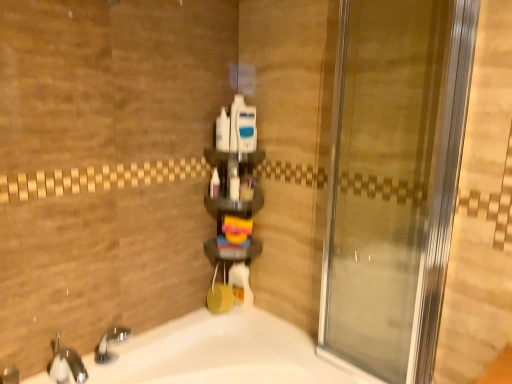
You are a GUI agent. You are given a task and a screenshot of the screen. Output one action in this format:
    pyautogui.click(x=<x>, y=<y>)
    Task: Click on the white plastic container at center, the 2th toiletry positioned from the right
    The image size is (512, 384).
    Given the screenshot: What is the action you would take?
    pyautogui.click(x=237, y=128)

Describe the element at coordinates (390, 186) in the screenshot. The image size is (512, 384). I see `transparent glass door at center` at that location.

Image resolution: width=512 pixels, height=384 pixels. Identify the location of white plastic bottles at center, placed as the 4th toiletry when sorted from right to left. (222, 131).

At what (x,y) coordinates should I click in order to perform the action: click on white glossy bathtub at lower left. Please return your answer as a coordinate pair (x, y). Image resolution: width=512 pixels, height=384 pixels. Looking at the image, I should click on (220, 353).

Is brushed metal faucet at lower left next to transparent glass door at center and touching it?

No, brushed metal faucet at lower left is not making contact with transparent glass door at center.

Based on their positions, is brushed metal faucet at lower left located to the left or right of transparent glass door at center?

Based on their positions, brushed metal faucet at lower left is located to the left of transparent glass door at center.

Is brushed metal faucet at lower left in front of or behind transparent glass door at center in the image?

Clearly, brushed metal faucet at lower left is behind transparent glass door at center.

Is point (16, 380) closer or farther from the camera than point (455, 51)?

Point (16, 380) is farther from the camera than point (455, 51).

Can you confirm if translucent plastic shelf at center is taller than brushed metal faucet at lower left?

Yes.

Locate an element on the screen. shelf that is on the right side of brushed metal faucet at lower left is located at coordinates (234, 160).

Consider the image. Choose the correct answer: Is translucent plastic shelf at center inside brushed metal faucet at lower left or outside it?

translucent plastic shelf at center exists outside the volume of brushed metal faucet at lower left.

Consider the image. Is translucent plastic shelf at center placed right next to brushed metal faucet at lower left?

No, translucent plastic shelf at center is not beside brushed metal faucet at lower left.

Does translucent plastic bottle at center, which is the 1th toiletry from left to right, have a smaller size compared to transparent glass door at center?

Yes.

From the picture: Which object is further away from the camera taking this photo, translucent plastic bottle at center, arranged as the fifth toiletry when viewed from the right, or transparent glass door at center?

translucent plastic bottle at center, arranged as the fifth toiletry when viewed from the right, is more distant.

Is point (214, 177) positioned after point (417, 371)?

That is True.

From a real-world perspective, between translucent plastic bottle at center, arranged as the fifth toiletry when viewed from the right, and transparent glass door at center, who is vertically lower?

In real-world perspective, translucent plastic bottle at center, arranged as the fifth toiletry when viewed from the right, is lower.

Can you see blue plastic razor at center, which is the first toiletry from right to left, touching white glossy bottle at center, which is counted as the 3th toiletry, starting from the right?

blue plastic razor at center, which is the first toiletry from right to left, and white glossy bottle at center, which is counted as the 3th toiletry, starting from the right, are not in contact.

Can you tell me how much blue plastic razor at center, which is the first toiletry from right to left, and white glossy bottle at center, which is counted as the 3th toiletry, starting from the right, differ in facing direction?

0.537 degrees.

In terms of size, does blue plastic razor at center, which is the first toiletry from right to left, appear bigger or smaller than white glossy bottle at center, positioned as the third toiletry in left-to-right order?

blue plastic razor at center, which is the first toiletry from right to left, is bigger than white glossy bottle at center, positioned as the third toiletry in left-to-right order.

From a real-world perspective, is blue plastic razor at center, the fifth toiletry from the left, physically located above or below white glossy bottle at center, which is counted as the 3th toiletry, starting from the right?

In terms of real-world spatial position, blue plastic razor at center, the fifth toiletry from the left, is above white glossy bottle at center, which is counted as the 3th toiletry, starting from the right.

Is translucent plastic shelf at center not close to white plastic container at center, the 4th toiletry when ordered from left to right?

Actually, translucent plastic shelf at center and white plastic container at center, the 4th toiletry when ordered from left to right, are a little close together.

From the image's perspective, which one is positioned higher, translucent plastic shelf at center or white plastic container at center, the 2th toiletry positioned from the right?

white plastic container at center, the 2th toiletry positioned from the right.

Between translucent plastic shelf at center and white plastic container at center, the 2th toiletry positioned from the right, which one has larger size?

With larger size is translucent plastic shelf at center.

Consider the image. From a real-world perspective, which is physically above, translucent plastic shelf at center or white plastic container at center, the 2th toiletry positioned from the right?

white plastic container at center, the 2th toiletry positioned from the right, from a real-world perspective.

Looking at this image, is brushed metal faucet at lower left spatially inside translucent plastic bottle at center, which is the 1th toiletry from left to right, or outside of it?

brushed metal faucet at lower left exists outside the volume of translucent plastic bottle at center, which is the 1th toiletry from left to right.

Considering the relative positions of brushed metal faucet at lower left and translucent plastic bottle at center, arranged as the fifth toiletry when viewed from the right, in the image provided, is brushed metal faucet at lower left in front of translucent plastic bottle at center, arranged as the fifth toiletry when viewed from the right,?

Yes, it is in front of translucent plastic bottle at center, arranged as the fifth toiletry when viewed from the right.

Is the surface of brushed metal faucet at lower left in direct contact with translucent plastic bottle at center, arranged as the fifth toiletry when viewed from the right?

brushed metal faucet at lower left and translucent plastic bottle at center, arranged as the fifth toiletry when viewed from the right, are not in contact.

Which of these two, transparent glass door at center or translucent plastic shelf at center, stands taller?

Standing taller between the two is transparent glass door at center.

Is transparent glass door at center to the left of translucent plastic shelf at center from the viewer's perspective?

In fact, transparent glass door at center is to the right of translucent plastic shelf at center.

Could you tell me if transparent glass door at center is facing translucent plastic shelf at center?

No, transparent glass door at center does not turn towards translucent plastic shelf at center.

In terms of size, does transparent glass door at center appear bigger or smaller than translucent plastic shelf at center?

Considering their sizes, transparent glass door at center takes up more space than translucent plastic shelf at center.

I want to click on faucet below the transparent glass door at center (from the image's perspective), so click(x=10, y=376).

The height and width of the screenshot is (384, 512). Identify the location of shelf above the brushed metal faucet at lower left (from the image's perspective). (234, 160).

Estimate the real-world distances between objects in this image. Which object is further from white plastic bottles at center, placed as the 2th toiletry when sorted from left to right, white glossy bottle at center, which is counted as the 3th toiletry, starting from the right, or translucent plastic shelf at center?

The object further to white plastic bottles at center, placed as the 2th toiletry when sorted from left to right, is white glossy bottle at center, which is counted as the 3th toiletry, starting from the right.

Based on their spatial positions, is translucent plastic bottle at center, which is the 1th toiletry from left to right, or white glossy bottle at center, positioned as the third toiletry in left-to-right order, closer to white glossy bathtub at lower left?

Based on the image, white glossy bottle at center, positioned as the third toiletry in left-to-right order, appears to be nearer to white glossy bathtub at lower left.

Looking at the image, which one is located closer to translucent plastic bottle at center, which is the 1th toiletry from left to right, blue plastic razor at center, the fifth toiletry from the left, or white glossy bathtub at lower left?

blue plastic razor at center, the fifth toiletry from the left, is positioned closer to the anchor translucent plastic bottle at center, which is the 1th toiletry from left to right.

Based on their spatial positions, is white plastic bottles at center, placed as the 4th toiletry when sorted from right to left, or white glossy bottle at center, positioned as the third toiletry in left-to-right order, closer to white plastic container at center, the 2th toiletry positioned from the right?

Among the two, white plastic bottles at center, placed as the 4th toiletry when sorted from right to left, is located nearer to white plastic container at center, the 2th toiletry positioned from the right.

Which object lies further to the anchor point polished chrome faucet at lower left, transparent glass door at center or translucent plastic bottle at center, which is the 1th toiletry from left to right?

Based on the image, transparent glass door at center appears to be further to polished chrome faucet at lower left.

Estimate the real-world distances between objects in this image. Which object is closer to blue plastic razor at center, the fifth toiletry from the left, translucent plastic bottle at center, which is the 1th toiletry from left to right, or white glossy bathtub at lower left?

translucent plastic bottle at center, which is the 1th toiletry from left to right.

From the image, which object appears to be farther from white glossy bathtub at lower left, white plastic bottles at center, placed as the 2th toiletry when sorted from left to right, or brushed metal faucet at lower left?

white plastic bottles at center, placed as the 2th toiletry when sorted from left to right, lies further to white glossy bathtub at lower left than the other object.

Which object lies further to the anchor point blue plastic razor at center, the fifth toiletry from the left, white plastic bottles at center, placed as the 2th toiletry when sorted from left to right, or translucent plastic bottle at center, arranged as the fifth toiletry when viewed from the right?

Based on the image, translucent plastic bottle at center, arranged as the fifth toiletry when viewed from the right, appears to be further to blue plastic razor at center, the fifth toiletry from the left.

At what (x,y) coordinates should I click in order to perform the action: click on shelf between white plastic bottles at center, placed as the 2th toiletry when sorted from left to right, and white glossy bathtub at lower left vertically. Please return your answer as a coordinate pair (x, y). Looking at the image, I should click on (234, 160).

Locate an element on the screen. shelf between transparent glass door at center and white glossy bathtub at lower left from top to bottom is located at coordinates (234, 160).

Find the location of a particular element. shelf that lies between white plastic bottles at center, placed as the 2th toiletry when sorted from left to right, and brushed metal faucet at lower left from top to bottom is located at coordinates (234, 160).

Locate an element on the screen. tap between white plastic container at center, the 4th toiletry when ordered from left to right, and brushed metal faucet at lower left vertically is located at coordinates (65, 364).